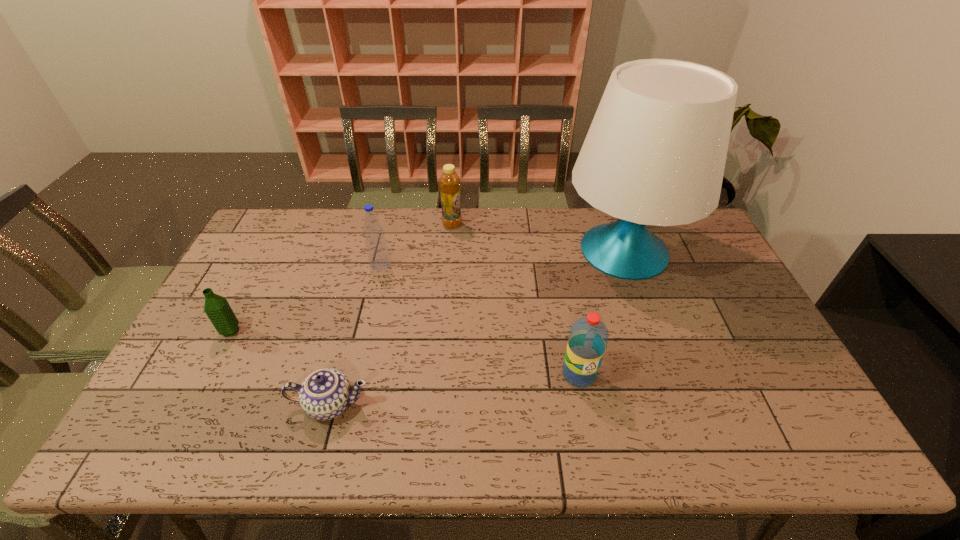
Identify the location of table lamp. Image resolution: width=960 pixels, height=540 pixels. (655, 153).

Locate an element on the screen. bottle is located at coordinates (449, 183).

Find the location of a particular element. The width and height of the screenshot is (960, 540). the second water bottle from left to right is located at coordinates (376, 246).

In order to click on the rightmost water bottle in this screenshot , I will do `click(588, 338)`.

Where is `the leftmost water bottle`? The image size is (960, 540). the leftmost water bottle is located at coordinates (218, 310).

Image resolution: width=960 pixels, height=540 pixels. I want to click on the shortest water bottle, so click(218, 310).

In order to click on the shortest object in this screenshot , I will do `click(325, 394)`.

The height and width of the screenshot is (540, 960). I want to click on vacant area located 0.310m on the front-facing side of the tallest object, so click(468, 251).

Find the location of a particular element. The image size is (960, 540). vacant point located on the front-facing side of the tallest object is located at coordinates coord(525,251).

Where is `free space located 0.380m on the front-facing side of the tallest object`? The image size is (960, 540). free space located 0.380m on the front-facing side of the tallest object is located at coordinates (448, 251).